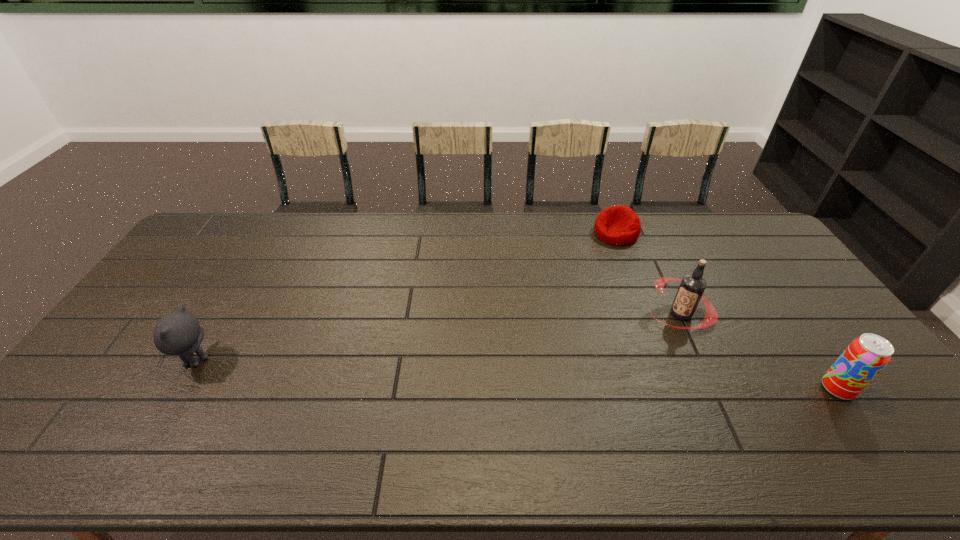
This screenshot has width=960, height=540. Identify the location of vacant space on the desktop that is between the leftmost object and the rightmost object and is positioned on the label of the root beer. [588, 378].

At what (x,y) coordinates should I click in order to perform the action: click on free space on the desktop that is between the kitten and the rightmost object and is positioned on the seat area of the shortest object. Please return your answer as a coordinate pair (x, y). This screenshot has width=960, height=540. Looking at the image, I should click on (x=526, y=375).